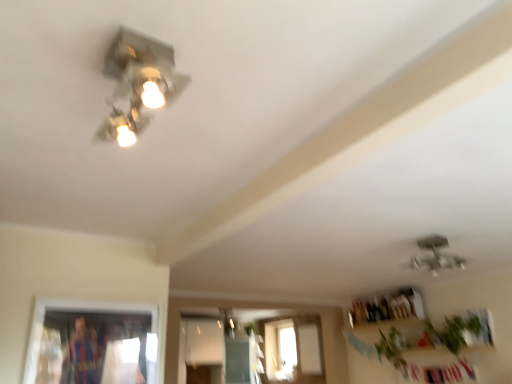
Question: Is metallic silver light fixture at upper center, the second lamp viewed from the front, situated inside green leafy plant at lower right, placed as the first plant when sorted from right to left, or outside?

Choices:
 (A) inside
 (B) outside

Answer: (B)

Question: Is metallic silver light fixture at upper center, the second lamp viewed from the front, wider or thinner than green leafy plant at lower right, which is the second plant in left-to-right order?

Choices:
 (A) thin
 (B) wide

Answer: (B)

Question: Estimate the real-world distances between objects in this image. Which object is farther from the green leafy plant at lower right, the second plant viewed from the right?

Choices:
 (A) metallic silver light fixture at upper center, the 2th lamp when ordered from top to bottom
 (B) metallic silver light fixture at upper left, the second lamp positioned from the right
 (C) green leafy plant at lower right, acting as the first plant starting from the front
 (D) matte silver lamp at center, which is counted as the third lamp, starting from the right

Answer: (B)

Question: Estimate the real-world distances between objects in this image. Which object is closer to the green leafy plant at lower right, the 1th plant from the back?

Choices:
 (A) green leafy plant at lower right, acting as the first plant starting from the front
 (B) matte silver lamp at center, the third lamp positioned from the front
 (C) metallic silver light fixture at upper left, placed as the first lamp when sorted from front to back
 (D) metallic silver light fixture at upper center, arranged as the 2th lamp when viewed from the back

Answer: (A)